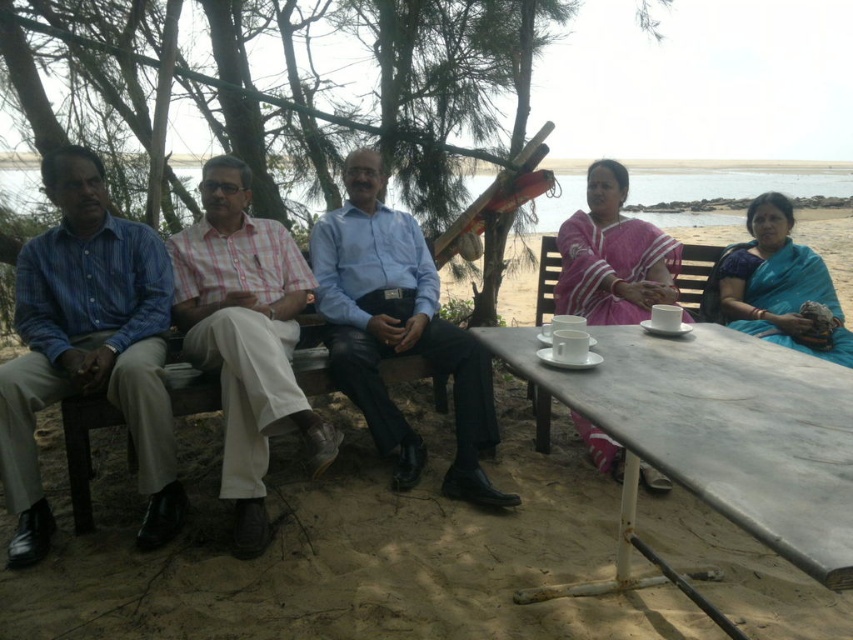
Question: Which of the following is the farthest from the observer?

Choices:
 (A) (642, 264)
 (B) (769, 492)

Answer: (A)

Question: Estimate the real-world distances between objects in this image. Which object is closer to the pink silk saree at center?

Choices:
 (A) pink checkered shirt at center
 (B) blue smooth shirt at center

Answer: (B)

Question: Can you confirm if pink checkered shirt at center is positioned to the left of blue cotton shirt at left?

Choices:
 (A) yes
 (B) no

Answer: (A)

Question: Does blue smooth shirt at center appear on the left side of blue cotton shirt at left?

Choices:
 (A) no
 (B) yes

Answer: (B)

Question: Estimate the real-world distances between objects in this image. Which object is farther from the blue striped shirt at left?

Choices:
 (A) pink silk saree at center
 (B) blue cotton shirt at left
 (C) white marble table at lower right
 (D) pink checkered shirt at center

Answer: (A)

Question: Can you confirm if blue striped shirt at left is smaller than pink checkered shirt at center?

Choices:
 (A) yes
 (B) no

Answer: (A)